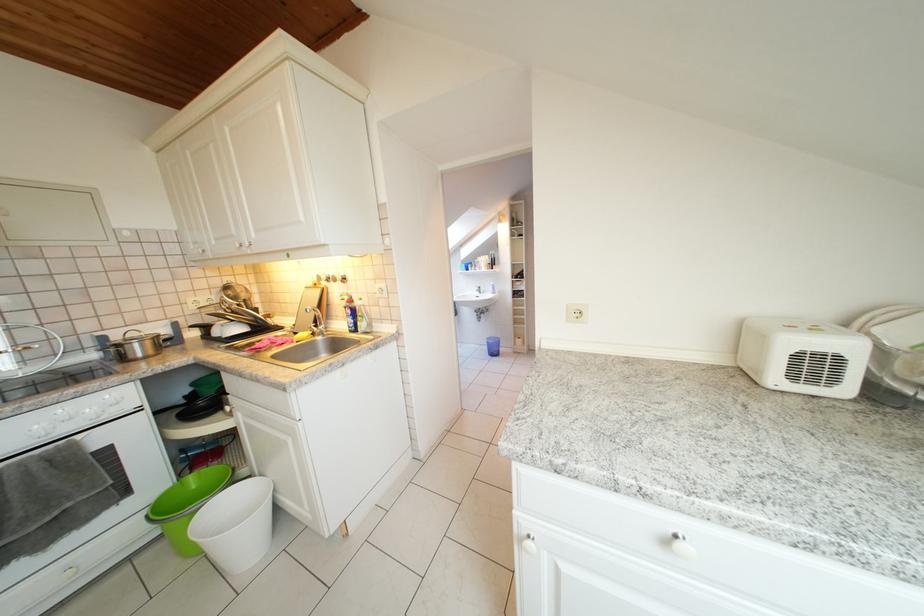
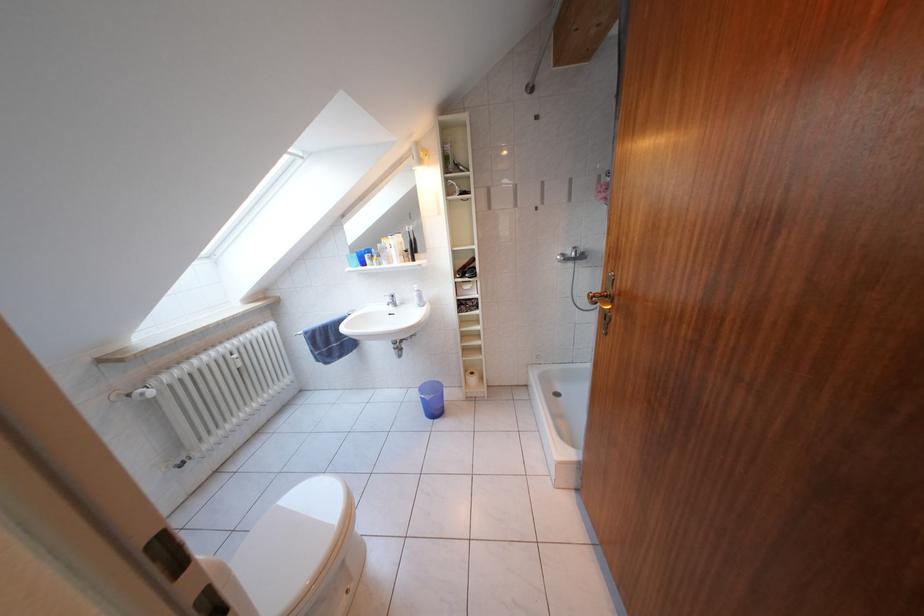
Question: What movement of the cameraman would produce the second image?

Choices:
 (A) Left
 (B) Right
 (C) Forward
 (D) Backward

Answer: (C)